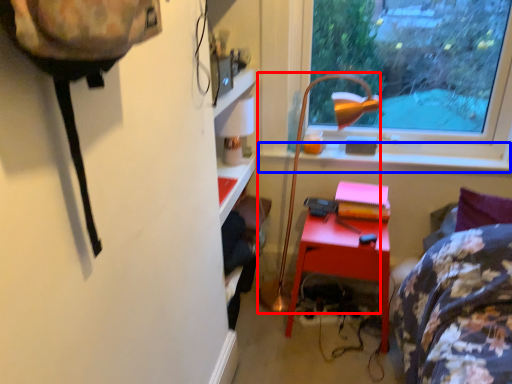
Question: Which object appears farthest to the camera in this image, lamp (highlighted by a red box) or window sill (highlighted by a blue box)?

Choices:
 (A) lamp
 (B) window sill

Answer: (B)